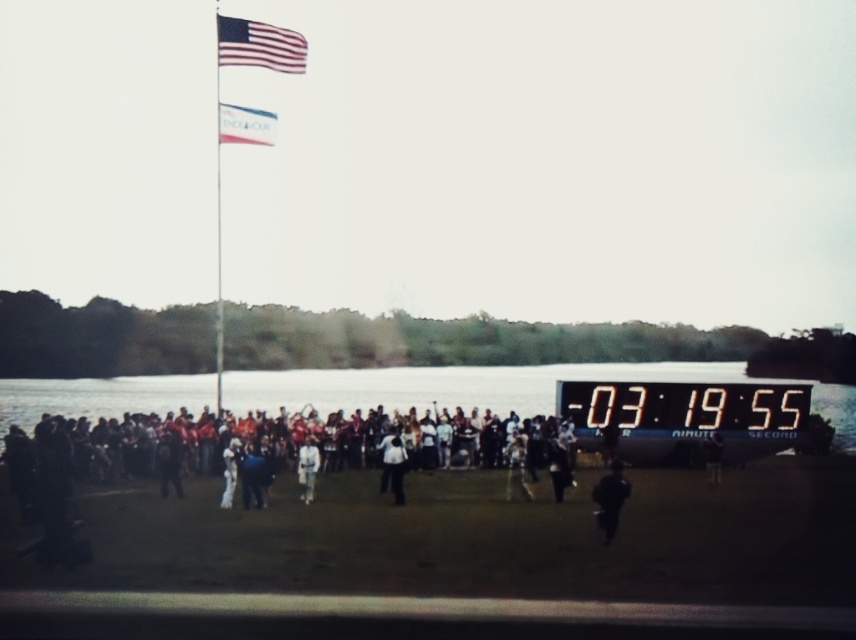
Between black matte person at lower right and white shirt at center, which one is positioned higher?

black matte person at lower right is above.

Is black matte person at lower right positioned behind white shirt at center?

No, black matte person at lower right is in front of white shirt at center.

Locate an element on the screen. black matte person at lower right is located at coordinates (610, 499).

Is metallic flag pole at upper left thinner than white fabric flag at upper center?

Incorrect, metallic flag pole at upper left's width is not less than white fabric flag at upper center's.

Between metallic flag pole at upper left and white fabric flag at upper center, which one has more height?

Standing taller between the two is metallic flag pole at upper left.

Image resolution: width=856 pixels, height=640 pixels. What are the coordinates of `metallic flag pole at upper left` in the screenshot? It's located at (220, 113).

Is the position of dark clothing crowd at center more distant than that of american flag at upper left?

That is False.

The width and height of the screenshot is (856, 640). What do you see at coordinates (245, 460) in the screenshot?
I see `dark clothing crowd at center` at bounding box center [245, 460].

Locate an element on the screen. This screenshot has width=856, height=640. dark clothing crowd at center is located at coordinates (245, 460).